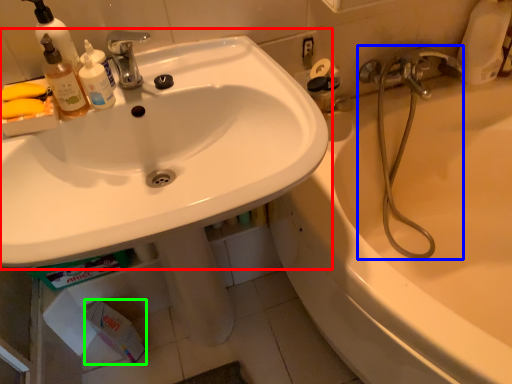
Question: Which object is positioned closest to sink (highlighted by a red box)? Select from plumbing fixture (highlighted by a blue box) and toilet paper (highlighted by a green box).

Choices:
 (A) plumbing fixture
 (B) toilet paper

Answer: (A)